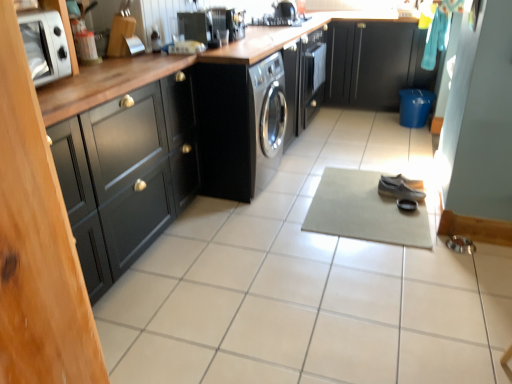
Question: Can you confirm if leather shoe at center, which ranks as the second shoe in back-to-front order, is positioned to the left of black matte cabinet at left, the first cabinetry ordered from the bottom?

Choices:
 (A) no
 (B) yes

Answer: (A)

Question: Is leather shoe at center, arranged as the first shoe when viewed from the front, closer to the viewer compared to black matte cabinet at left, the 2th cabinetry in the top-to-bottom sequence?

Choices:
 (A) no
 (B) yes

Answer: (A)

Question: Could you tell me if leather shoe at center, arranged as the first shoe when viewed from the front, is facing black matte cabinet at left, positioned as the 1th cabinetry in front-to-back order?

Choices:
 (A) no
 (B) yes

Answer: (A)

Question: Are leather shoe at center, arranged as the first shoe when viewed from the front, and black matte cabinet at left, which is counted as the 2th cabinetry, starting from the back, far apart?

Choices:
 (A) yes
 (B) no

Answer: (A)

Question: From the image's perspective, is leather shoe at center, which ranks as the second shoe in back-to-front order, located above black matte cabinet at left, the first cabinetry ordered from the bottom?

Choices:
 (A) no
 (B) yes

Answer: (A)

Question: In the image, is leather shoe at center, arranged as the first shoe when viewed from the front, positioned in front of or behind black matte cabinet at left, which is counted as the 2th cabinetry, starting from the back?

Choices:
 (A) behind
 (B) front

Answer: (A)

Question: From the image's perspective, is leather shoe at center, arranged as the first shoe when viewed from the front, located above or below black matte cabinet at left, the 2th cabinetry positioned from the right?

Choices:
 (A) below
 (B) above

Answer: (A)

Question: Does point (393, 183) appear closer or farther from the camera than point (70, 185)?

Choices:
 (A) farther
 (B) closer

Answer: (A)

Question: From a real-world perspective, is leather shoe at center, which ranks as the second shoe in back-to-front order, above or below black matte cabinet at left, the 2th cabinetry in the top-to-bottom sequence?

Choices:
 (A) above
 (B) below

Answer: (B)

Question: From their relative heights in the image, would you say beige fabric yoga mat at center is taller or shorter than silver metallic microwave at upper left?

Choices:
 (A) tall
 (B) short

Answer: (B)

Question: Looking at their shapes, would you say beige fabric yoga mat at center is wider or thinner than silver metallic microwave at upper left?

Choices:
 (A) thin
 (B) wide

Answer: (B)

Question: Visually, is beige fabric yoga mat at center positioned to the left or to the right of silver metallic microwave at upper left?

Choices:
 (A) right
 (B) left

Answer: (A)

Question: From a real-world perspective, is beige fabric yoga mat at center above or below silver metallic microwave at upper left?

Choices:
 (A) below
 (B) above

Answer: (A)

Question: In terms of height, does black glossy stove at upper center look taller or shorter compared to black matte cabinet at left, the first cabinetry ordered from the bottom?

Choices:
 (A) tall
 (B) short

Answer: (B)

Question: Considering their positions, is black glossy stove at upper center located in front of or behind black matte cabinet at left, the 2th cabinetry positioned from the right?

Choices:
 (A) behind
 (B) front

Answer: (A)